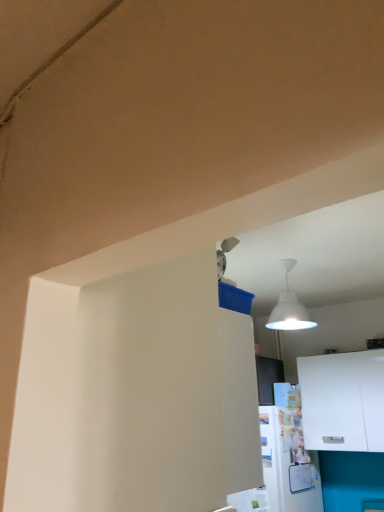
Measure the distance between white matte cabinet at lower right and camera.

2.43 meters.

This screenshot has width=384, height=512. What do you see at coordinates (343, 401) in the screenshot?
I see `white matte cabinet at lower right` at bounding box center [343, 401].

In order to click on white matte cabinet at lower right in this screenshot , I will do `click(343, 401)`.

This screenshot has width=384, height=512. What do you see at coordinates (283, 466) in the screenshot?
I see `white glossy refrigerator at lower right` at bounding box center [283, 466].

At what (x,y) coordinates should I click in order to perform the action: click on white glossy refrigerator at lower right. Please return your answer as a coordinate pair (x, y). The image size is (384, 512). Looking at the image, I should click on (283, 466).

This screenshot has width=384, height=512. Identify the location of white matte cabinet at lower right. (343, 401).

Which object is positioned more to the right, white glossy refrigerator at lower right or white matte cabinet at lower right?

white matte cabinet at lower right.

Which object is more forward, white glossy refrigerator at lower right or white matte cabinet at lower right?

white glossy refrigerator at lower right is in front.

Is point (275, 463) in front of point (314, 410)?

Yes, point (275, 463) is closer to viewer.

From the image's perspective, would you say white glossy refrigerator at lower right is shown under white matte cabinet at lower right?

Yes.

From a real-world perspective, is white glossy refrigerator at lower right on white matte cabinet at lower right?

No, from a real-world perspective, white glossy refrigerator at lower right is not over white matte cabinet at lower right

Is white glossy refrigerator at lower right thinner than white matte cabinet at lower right?

In fact, white glossy refrigerator at lower right might be wider than white matte cabinet at lower right.

Considering the sizes of white glossy refrigerator at lower right and white matte cabinet at lower right in the image, is white glossy refrigerator at lower right taller or shorter than white matte cabinet at lower right?

Clearly, white glossy refrigerator at lower right is taller compared to white matte cabinet at lower right.

Does white glossy refrigerator at lower right have a larger size compared to white matte cabinet at lower right?

Correct, white glossy refrigerator at lower right is larger in size than white matte cabinet at lower right.

Is white glossy refrigerator at lower right positioned beyond the bounds of white matte cabinet at lower right?

white glossy refrigerator at lower right is positioned outside white matte cabinet at lower right.

Are white glossy refrigerator at lower right and white matte cabinet at lower right beside each other?

→ There is a gap between white glossy refrigerator at lower right and white matte cabinet at lower right.

Could you tell me if white glossy refrigerator at lower right is turned towards white matte cabinet at lower right?

No, white glossy refrigerator at lower right is not facing towards white matte cabinet at lower right.

What's the angular difference between white glossy refrigerator at lower right and white matte cabinet at lower right's facing directions?

They differ by 0.824 degrees in their facing directions.

I want to click on appliance below the white matte cabinet at lower right (from a real-world perspective), so click(x=283, y=466).

Is white matte cabinet at lower right at the left side of white glossy refrigerator at lower right?

In fact, white matte cabinet at lower right is to the right of white glossy refrigerator at lower right.

Which object is more forward, white matte cabinet at lower right or white glossy refrigerator at lower right?

Positioned in front is white glossy refrigerator at lower right.

Between point (363, 403) and point (267, 461), which one is positioned in front?

The point (267, 461) is in front.

From the image's perspective, which one is positioned lower, white matte cabinet at lower right or white glossy refrigerator at lower right?

white glossy refrigerator at lower right appears lower in the image.

Looking at this image, from a real-world perspective, is white matte cabinet at lower right located higher than white glossy refrigerator at lower right?

Yes, from a real-world perspective, white matte cabinet at lower right is on top of white glossy refrigerator at lower right.

Which of these two, white matte cabinet at lower right or white glossy refrigerator at lower right, is thinner?

white matte cabinet at lower right is thinner.

Between white matte cabinet at lower right and white glossy refrigerator at lower right, which one has more height?

With more height is white glossy refrigerator at lower right.

In the scene shown: Considering the relative sizes of white matte cabinet at lower right and white glossy refrigerator at lower right in the image provided, is white matte cabinet at lower right smaller than white glossy refrigerator at lower right?

Correct, white matte cabinet at lower right occupies less space than white glossy refrigerator at lower right.

Is white matte cabinet at lower right surrounding white glossy refrigerator at lower right?

No, white matte cabinet at lower right does not contain white glossy refrigerator at lower right.

Is white matte cabinet at lower right in contact with white glossy refrigerator at lower right?

No, white matte cabinet at lower right is not with white glossy refrigerator at lower right.

Based on the photo, is white matte cabinet at lower right oriented towards white glossy refrigerator at lower right?

Result: No, white matte cabinet at lower right does not turn towards white glossy refrigerator at lower right.

Can you tell me how much white matte cabinet at lower right and white glossy refrigerator at lower right differ in facing direction?

white matte cabinet at lower right and white glossy refrigerator at lower right are facing 0.824 degrees away from each other.

Measure the distance from white matte cabinet at lower right to white glossy refrigerator at lower right.

white matte cabinet at lower right is 11.60 inches away from white glossy refrigerator at lower right.

At what (x,y) coordinates should I click in order to perform the action: click on appliance below the white matte cabinet at lower right (from the image's perspective). Please return your answer as a coordinate pair (x, y). The height and width of the screenshot is (512, 384). Looking at the image, I should click on click(283, 466).

This screenshot has width=384, height=512. I want to click on cabinetry that appears above the white glossy refrigerator at lower right (from a real-world perspective), so click(343, 401).

I want to click on cabinetry above the white glossy refrigerator at lower right (from the image's perspective), so click(x=343, y=401).